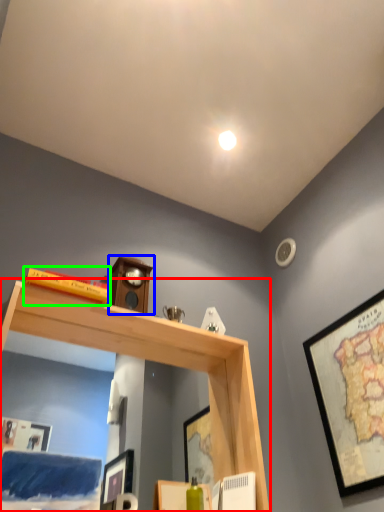
Question: Based on their relative distances, which object is nearer to shelf (highlighted by a red box)? Choose from clock (highlighted by a blue box) and book (highlighted by a green box).

Choices:
 (A) clock
 (B) book

Answer: (A)